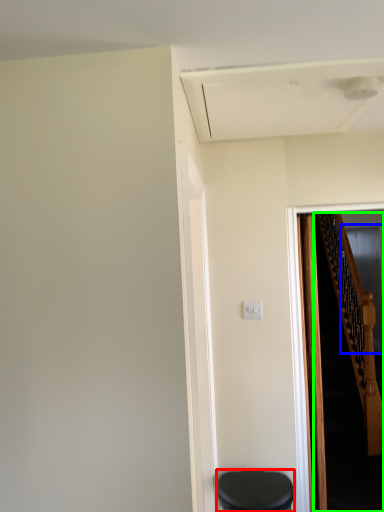
Question: Which is farther away from furniture (highlighted by a red box)? glass door (highlighted by a blue box) or stairs (highlighted by a green box)?

Choices:
 (A) glass door
 (B) stairs

Answer: (A)